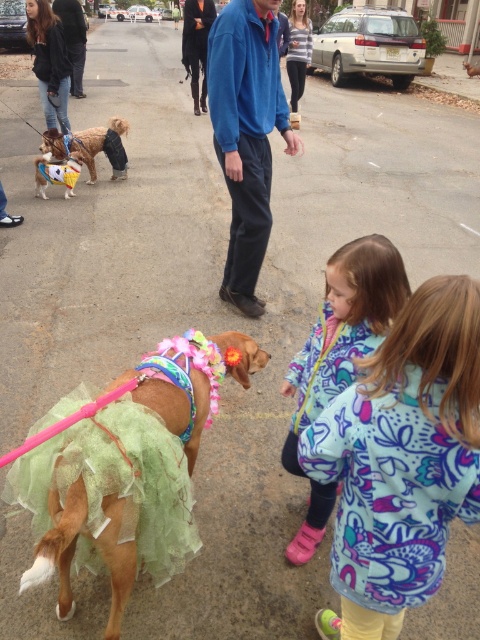
You are a photographer trying to capture a group photo of the printed fleece jacket at lower right and the brown plush dog at left. You want to ensure both subjects are fully visible in the frame. Based on their sizes, which subject should you focus on to ensure they fit comfortably in the photo?

The printed fleece jacket at lower right is narrower than the brown plush dog at left, so focusing on the brown plush dog at left will ensure both fit comfortably in the photo.